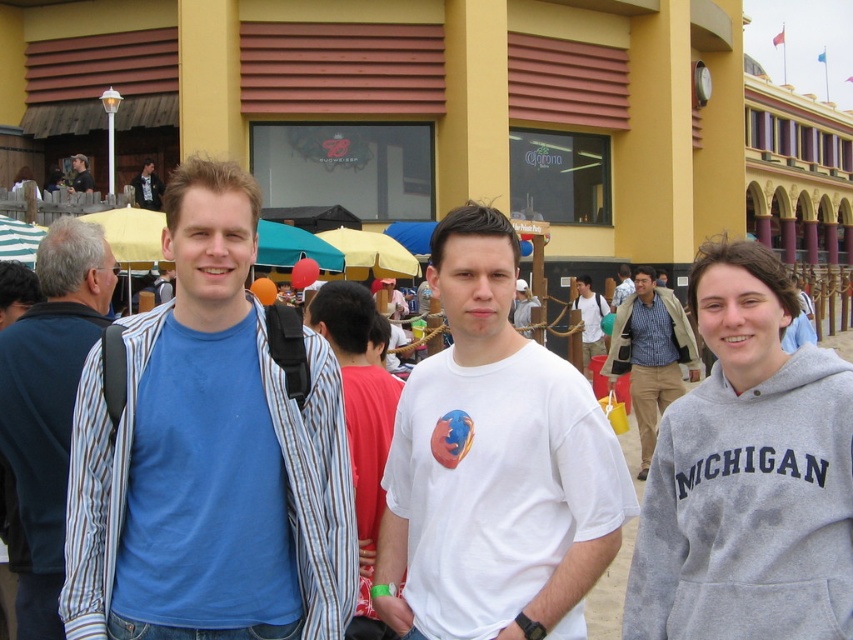
Question: Can you confirm if white cotton t-shirt at center is thinner than white striped umbrella at left?

Choices:
 (A) yes
 (B) no

Answer: (A)

Question: Is blue cotton shirt at center thinner than gray fleece sweatshirt at right?

Choices:
 (A) no
 (B) yes

Answer: (A)

Question: Which point is closer to the camera?

Choices:
 (A) white cotton t-shirt at center
 (B) blue plaid shirt at center
 (C) blue striped shirt at left
 (D) yellow fabric umbrella at center

Answer: (C)

Question: Considering the real-world distances, which object is farthest from the white matte t-shirt at center?

Choices:
 (A) matte black jacket at upper left
 (B) matte blue shirt at center
 (C) gray fleece sweatshirt at right
 (D) yellow fabric umbrella at center

Answer: (A)

Question: Is blue plaid shirt at center above matte black shirt at upper left?

Choices:
 (A) yes
 (B) no

Answer: (B)

Question: Which object appears farthest from the camera in this image?

Choices:
 (A) matte black shirt at upper left
 (B) red shirt at center
 (C) blue cotton shirt at center

Answer: (A)